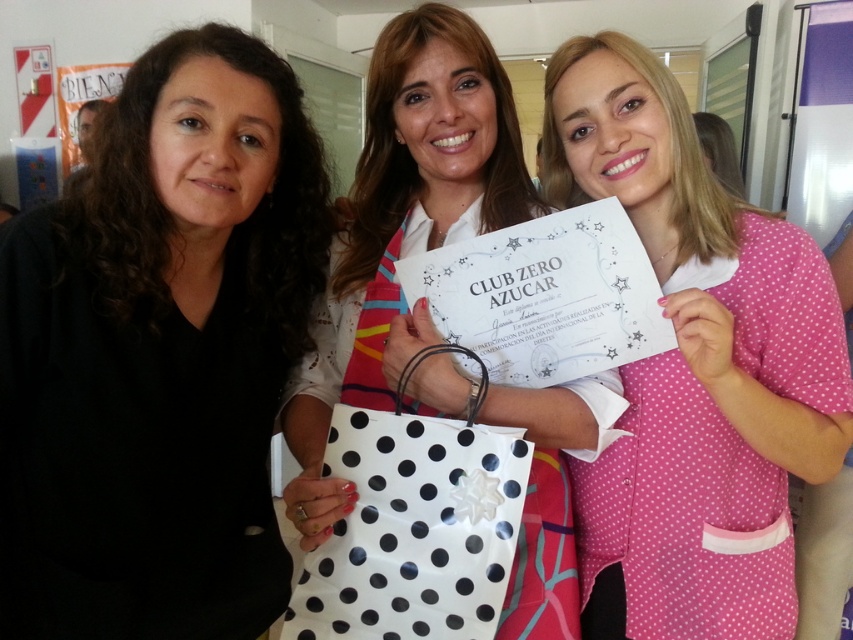
Question: Is pink polka dot scrubs at center smaller than white paper certificate at center?

Choices:
 (A) yes
 (B) no

Answer: (A)

Question: Does black matte shirt at center appear on the right side of pink polka dot scrubs at center?

Choices:
 (A) no
 (B) yes

Answer: (A)

Question: Which object is positioned farthest from the black matte shirt at center?

Choices:
 (A) white paper certificate at center
 (B) pink polka dot scrubs at center

Answer: (B)

Question: Is black matte shirt at center positioned in front of pink polka dot scrubs at center?

Choices:
 (A) yes
 (B) no

Answer: (A)

Question: Which point is farther from the camera taking this photo?

Choices:
 (A) (561, 173)
 (B) (515, 200)
 (C) (326, 572)

Answer: (A)

Question: Which of the following is the closest to the observer?

Choices:
 (A) white paper certificate at center
 (B) white dotted paper bag at center
 (C) pink polka dot scrubs at center
 (D) black matte shirt at center

Answer: (D)